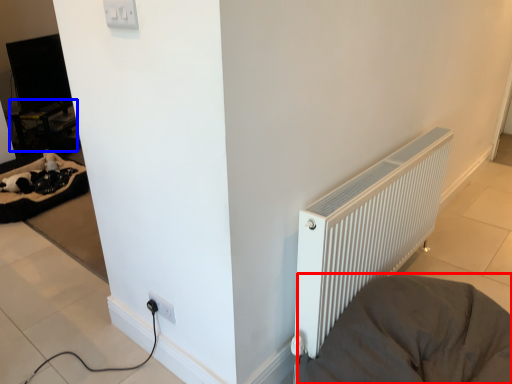
Question: Which object is further to the camera taking this photo, furniture (highlighted by a red box) or table (highlighted by a blue box)?

Choices:
 (A) furniture
 (B) table

Answer: (B)